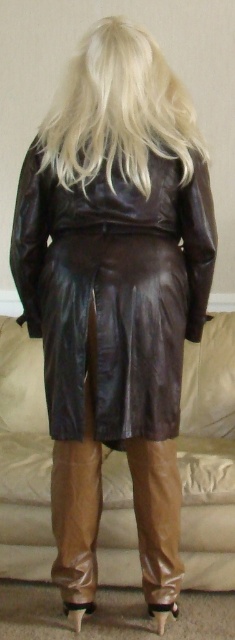
Who is more forward, (63, 412) or (0, 570)?

Point (63, 412)

This screenshot has width=235, height=640. What are the coordinates of `brown leather jacket at center` in the screenshot? It's located at (113, 291).

Locate an element on the screen. This screenshot has height=640, width=235. brown leather jacket at center is located at coordinates (113, 291).

Between brown leather couch at lower center and blondehair at upper center, which one has more height?

Standing taller between the two is brown leather couch at lower center.

Between point (7, 548) and point (117, 45), which one is positioned in front?

Point (117, 45) is more forward.

Find the location of a particular element. brown leather couch at lower center is located at coordinates (207, 458).

Between brown leather jacket at center and blondehair at upper center, which one has less height?

blondehair at upper center

Can you confirm if brown leather jacket at center is thinner than blondehair at upper center?

No.

Is point (149, 404) positioned behind point (191, 163)?

No, it is in front of (191, 163).

Locate an element on the screen. The height and width of the screenshot is (640, 235). brown leather jacket at center is located at coordinates (113, 291).